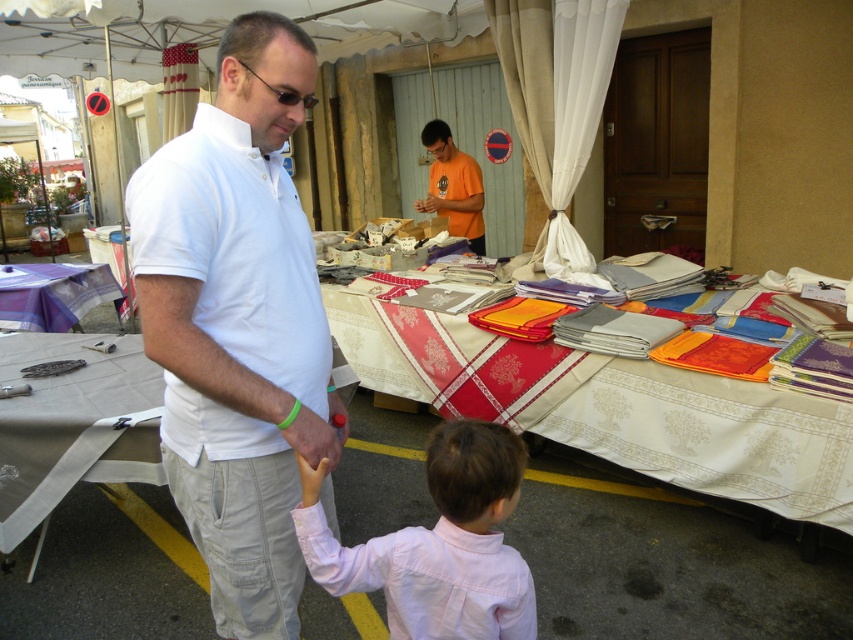
Who is shorter, white cotton shirt at center or white embroidered tablecloth at center?

With less height is white embroidered tablecloth at center.

Identify the location of white cotton shirt at center. (238, 324).

Is white embroidered tablecloth at center in front of white fabric table at left?

No, it is behind white fabric table at left.

In the scene shown: Between white embroidered tablecloth at center and white fabric table at left, which one has less height?

white embroidered tablecloth at center

You are a GUI agent. You are given a task and a screenshot of the screen. Output one action in this format:
    pyautogui.click(x=<x>, y=<y>)
    Task: Click on the white embroidered tablecloth at center
    Image resolution: width=853 pixels, height=640 pixels.
    Given the screenshot: What is the action you would take?
    pyautogui.click(x=614, y=408)

Is point (308, 404) closer to camera compared to point (463, 200)?

Yes, point (308, 404) is closer to viewer.

Can you confirm if white cotton shirt at center is positioned above orange cotton t-shirt at center?

Actually, white cotton shirt at center is below orange cotton t-shirt at center.

What are the coordinates of `white cotton shirt at center` in the screenshot? It's located at (238, 324).